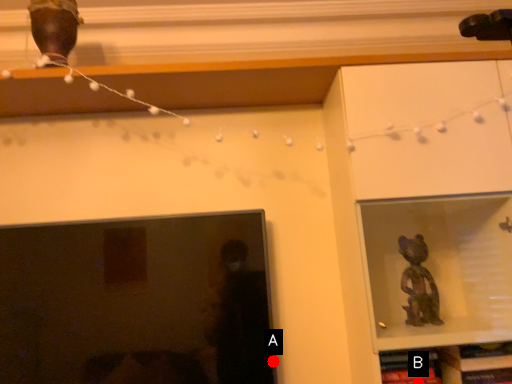
Question: Two points are circled on the image, labeled by A and B beside each circle. Which point is farther from the camera taking this photo?

Choices:
 (A) A is further
 (B) B is further

Answer: (A)